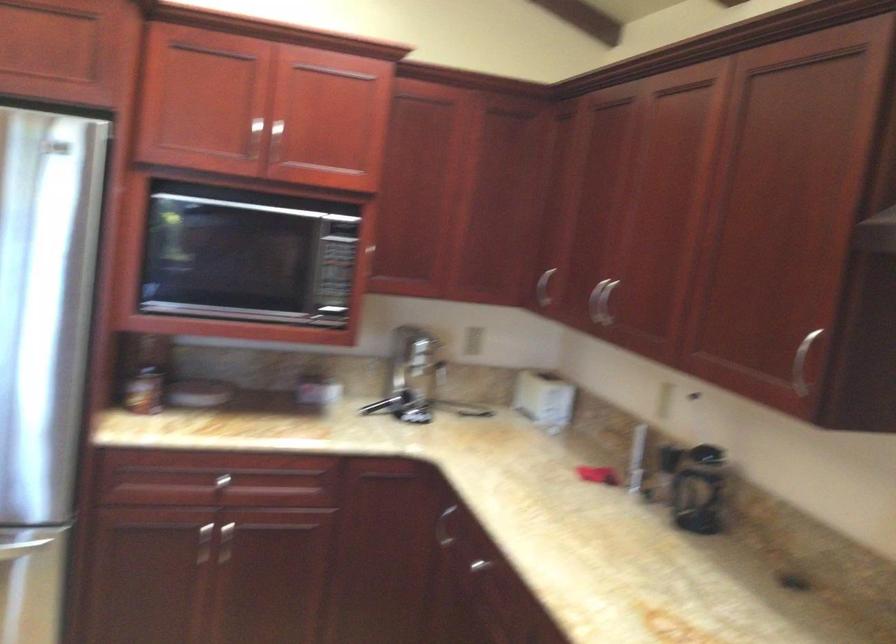
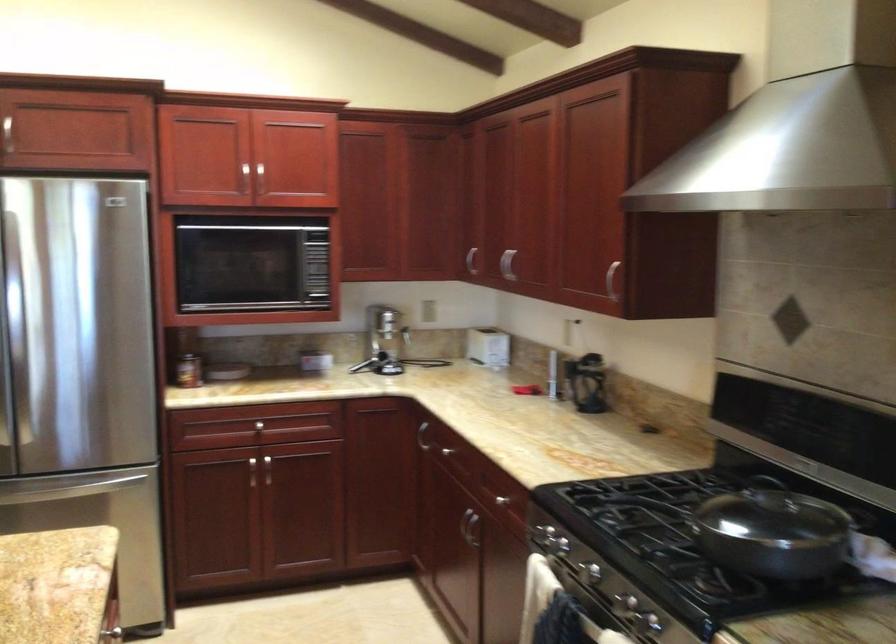
Locate, in the second image, the point that corresponds to point (446, 522) in the first image.

(421, 436)